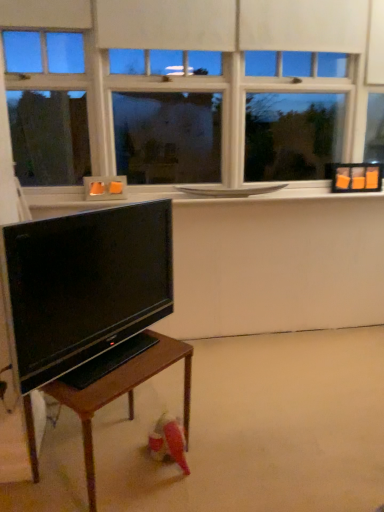
Question: From their relative heights in the image, would you say white glossy window sill at upper center is taller or shorter than wooden table at lower left?

Choices:
 (A) short
 (B) tall

Answer: (A)

Question: Is white glossy window sill at upper center to the left or to the right of wooden table at lower left in the image?

Choices:
 (A) left
 (B) right

Answer: (B)

Question: Which of these objects is positioned closest to the wooden table at lower left?

Choices:
 (A) white matte window at upper center
 (B) white glossy window sill at upper center
 (C) matte black tv at lower left

Answer: (C)

Question: Which is farther from the white matte window at upper center?

Choices:
 (A) wooden table at lower left
 (B) matte black tv at lower left
 (C) white glossy window sill at upper center

Answer: (A)